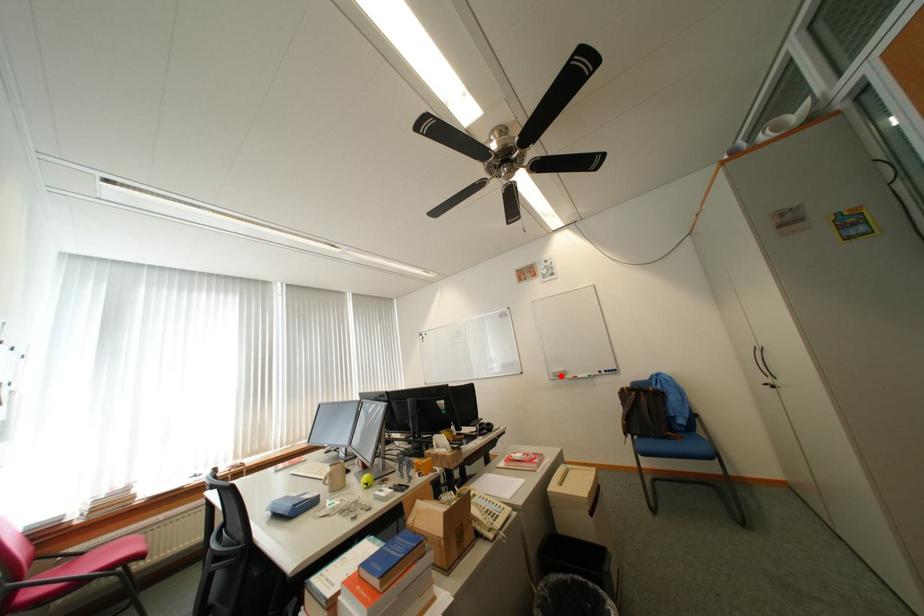
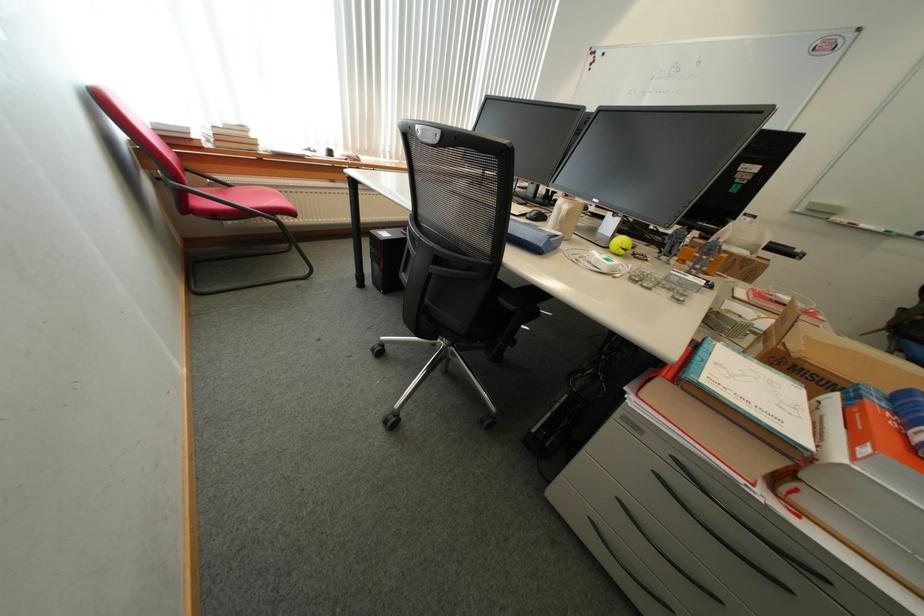
Where in the second image is the point corresponding to the highlighted location from the first image?

(815, 207)